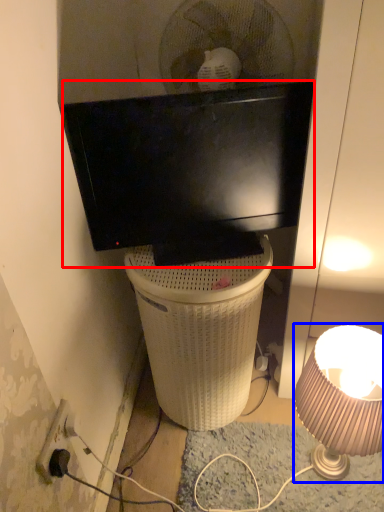
Question: Which object appears closest to the camera in this image, television (highlighted by a red box) or lamp (highlighted by a blue box)?

Choices:
 (A) television
 (B) lamp

Answer: (B)